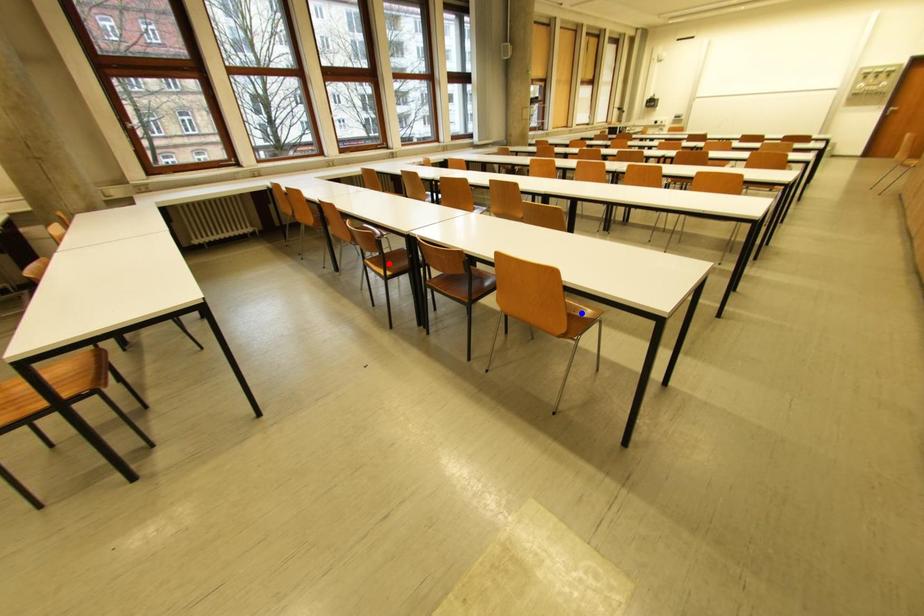
Question: Two points are marked on the image. Which point is closer to the camera?

Choices:
 (A) Blue point is closer.
 (B) Red point is closer.

Answer: (A)